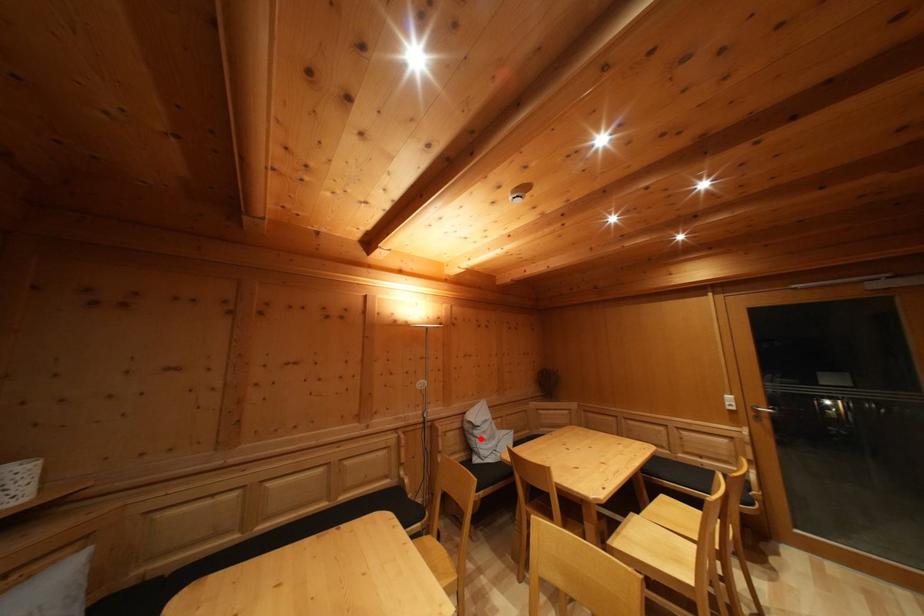
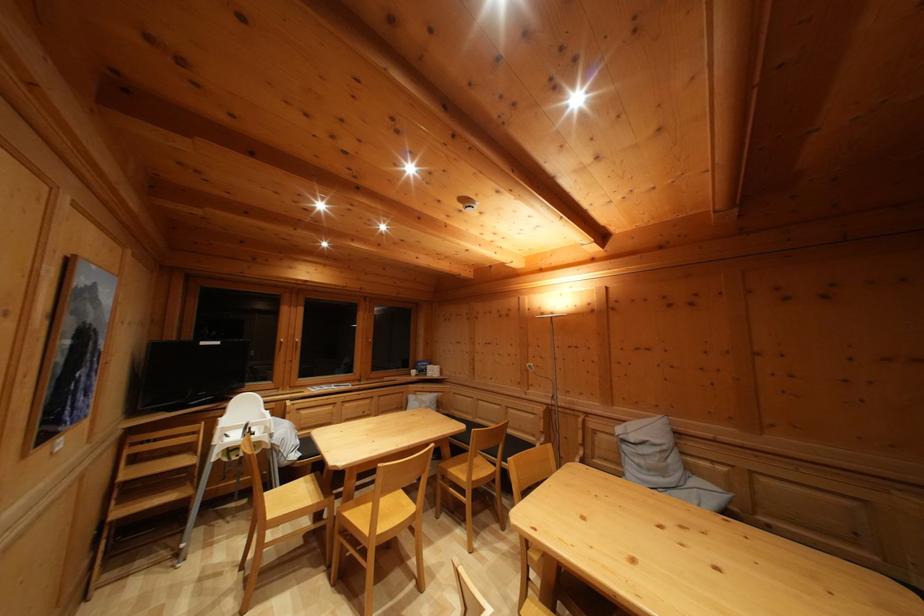
Find the pixel in the second image that matches the highlighted location in the first image.

(629, 454)